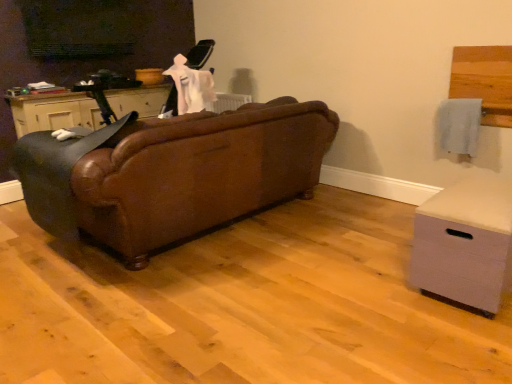
Question: Can you see brown leather rocking chair at left touching light gray fabric chest of drawers at lower right?

Choices:
 (A) yes
 (B) no

Answer: (B)

Question: From a real-world perspective, is brown leather rocking chair at left on top of light gray fabric chest of drawers at lower right?

Choices:
 (A) no
 (B) yes

Answer: (B)

Question: Does brown leather rocking chair at left have a larger size compared to light gray fabric chest of drawers at lower right?

Choices:
 (A) yes
 (B) no

Answer: (A)

Question: Is brown leather rocking chair at left outside of light gray fabric chest of drawers at lower right?

Choices:
 (A) yes
 (B) no

Answer: (A)

Question: Does brown leather rocking chair at left have a lesser width compared to light gray fabric chest of drawers at lower right?

Choices:
 (A) yes
 (B) no

Answer: (B)

Question: Is brown leather rocking chair at left to the right of light gray fabric chest of drawers at lower right from the viewer's perspective?

Choices:
 (A) no
 (B) yes

Answer: (A)

Question: Is light gray fabric chest of drawers at lower right directly adjacent to brown leather rocking chair at left?

Choices:
 (A) no
 (B) yes

Answer: (A)

Question: Is brown leather rocking chair at left a part of light gray fabric chest of drawers at lower right?

Choices:
 (A) no
 (B) yes

Answer: (A)

Question: From the image's perspective, is light gray fabric chest of drawers at lower right above brown leather rocking chair at left?

Choices:
 (A) no
 (B) yes

Answer: (A)

Question: Does light gray fabric chest of drawers at lower right turn towards brown leather rocking chair at left?

Choices:
 (A) yes
 (B) no

Answer: (B)

Question: Considering the relative positions of light gray fabric chest of drawers at lower right and brown leather rocking chair at left in the image provided, is light gray fabric chest of drawers at lower right behind brown leather rocking chair at left?

Choices:
 (A) yes
 (B) no

Answer: (B)

Question: From the image's perspective, is light gray fabric chest of drawers at lower right under brown leather rocking chair at left?

Choices:
 (A) no
 (B) yes

Answer: (B)

Question: From a real-world perspective, is matte black cabinet at left positioned over light gray fabric chest of drawers at lower right based on gravity?

Choices:
 (A) no
 (B) yes

Answer: (B)